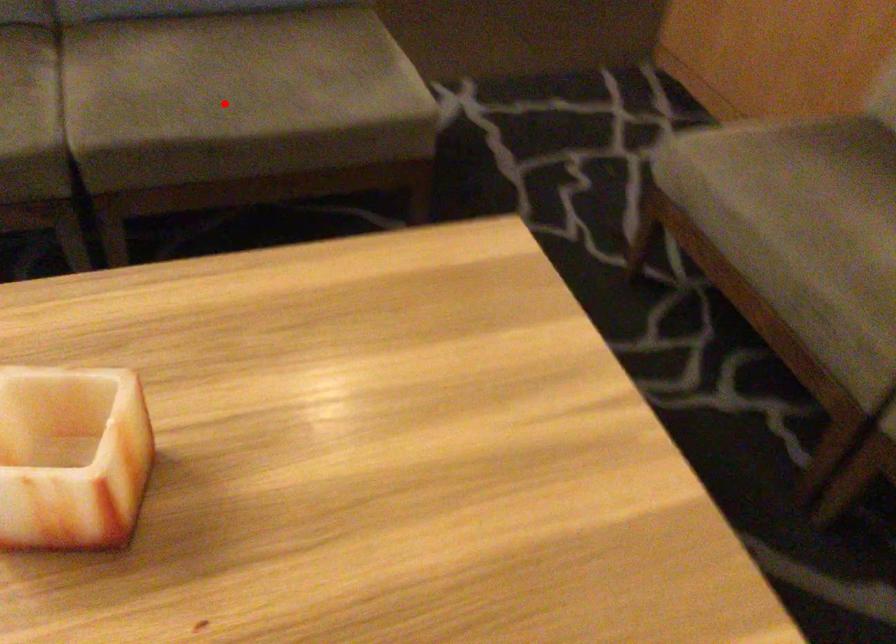
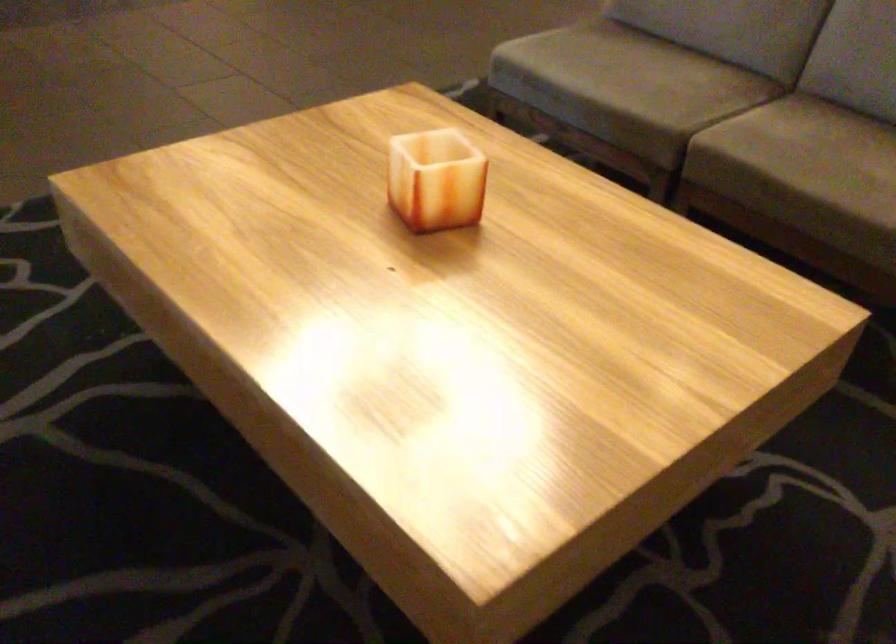
Find the pixel in the second image that matches the highlighted location in the first image.

(800, 161)